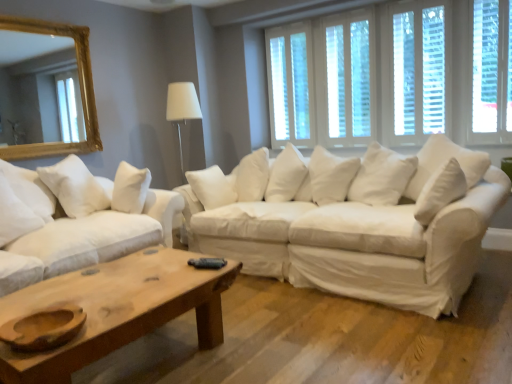
The image size is (512, 384). I want to click on blank space situated above white wooden blinds at upper right, the 3th window from the left (from a real-world perspective), so click(412, 1).